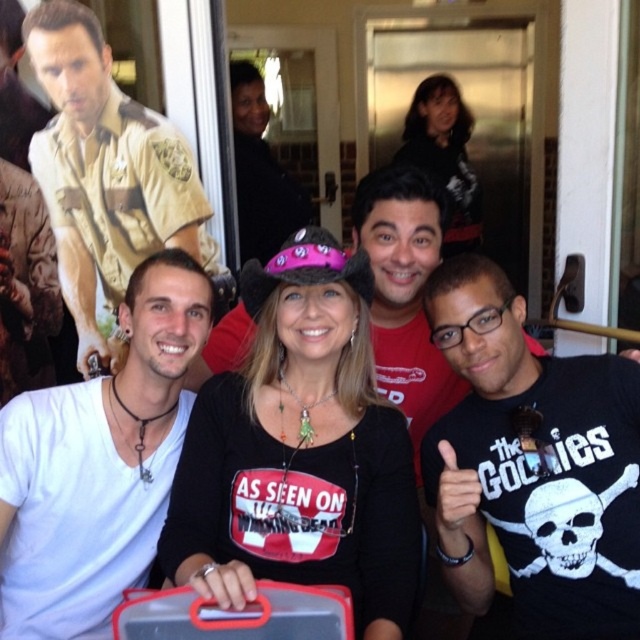
You are trying to identify the person wearing the white matte shirt at center and the matte khaki uniform at left. Based on their positions, which one is located to the right of the other?

The white matte shirt at center is positioned on the right side of the matte khaki uniform at left, so the white matte shirt at center is to the right of the matte khaki uniform at left.

You are a photographer setting up for a group photo. You need to ensure that the two subjects wearing the white matte shirt at center and the matte khaki uniform at left are positioned at least 30 inches apart for better visibility. Based on the current setup, is this requirement met?

The white matte shirt at center is only 24.09 inches away from the matte khaki uniform at left, which is less than the required 30 inches. Therefore, the subjects are too close to meet the visibility requirement.